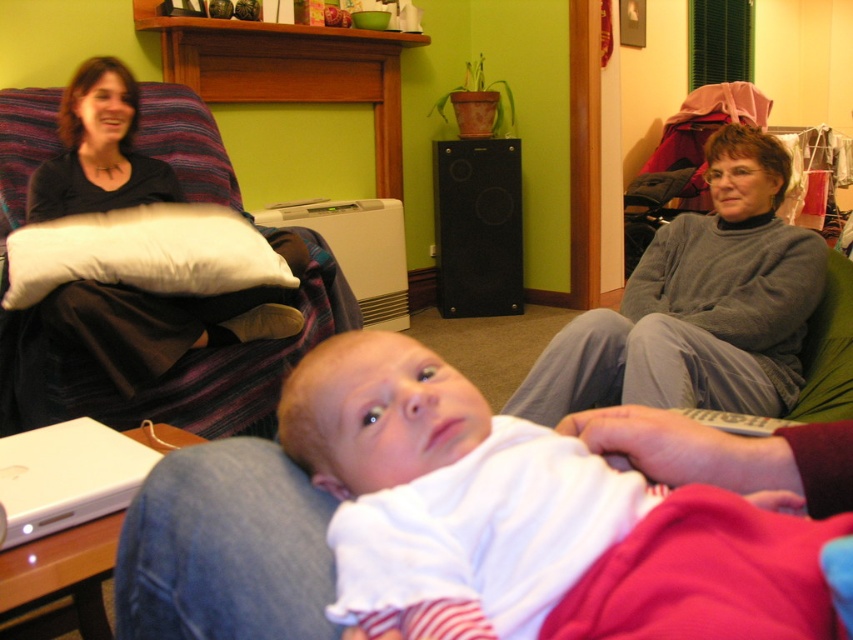
Can you confirm if white soft fabric baby at center is positioned below gray sweater at right?

Yes, white soft fabric baby at center is below gray sweater at right.

Is point (552, 557) more distant than point (605, 358)?

No.

Image resolution: width=853 pixels, height=640 pixels. Find the location of `white soft fabric baby at center`. white soft fabric baby at center is located at coordinates (527, 518).

Is white soft fabric baby at center smaller than white soft pillow at upper left?

Yes.

In the scene shown: Measure the distance from white soft fabric baby at center to white soft pillow at upper left.

white soft fabric baby at center is 1.60 meters from white soft pillow at upper left.

Describe the element at coordinates (527, 518) in the screenshot. The width and height of the screenshot is (853, 640). I see `white soft fabric baby at center` at that location.

I want to click on white soft fabric baby at center, so click(527, 518).

Consider the image. Between matte black shirt at left and white matte laptop at lower left, which one appears on the left side from the viewer's perspective?

From the viewer's perspective, matte black shirt at left appears more on the left side.

Measure the distance between point (83,102) and camera.

Point (83,102) and camera are 8.03 feet apart.

Locate an element on the screen. matte black shirt at left is located at coordinates (99, 150).